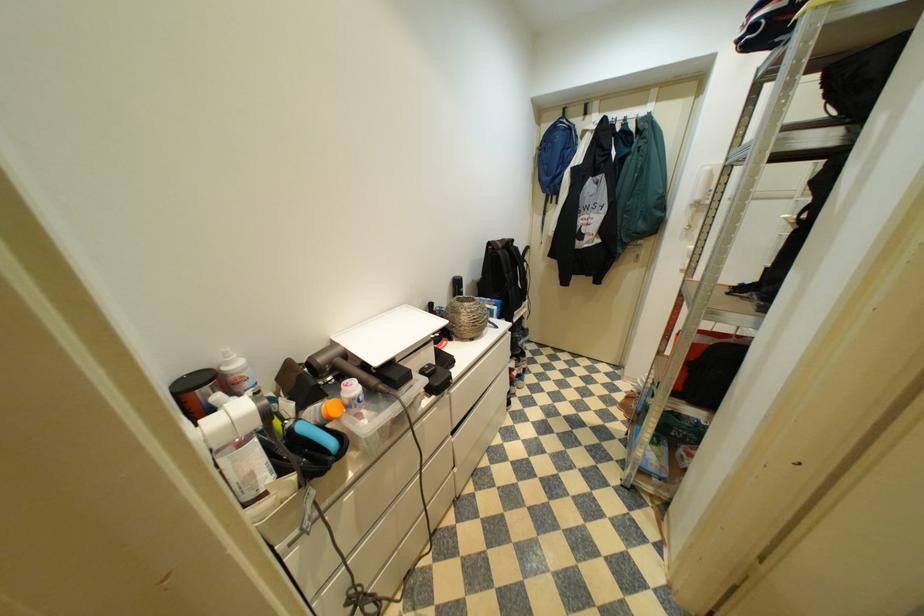
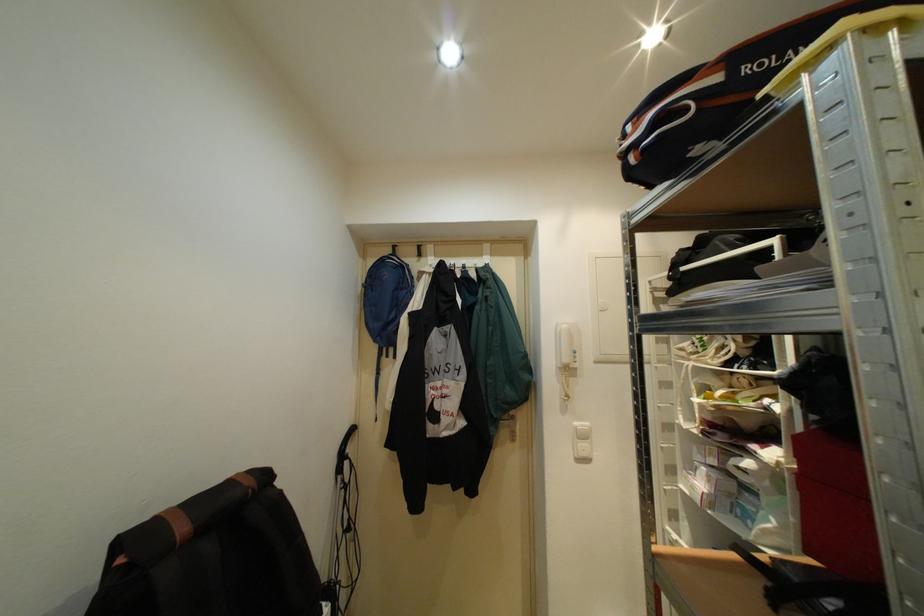
Locate, in the second image, the point that corresponds to (x=716, y=169) in the first image.

(573, 328)